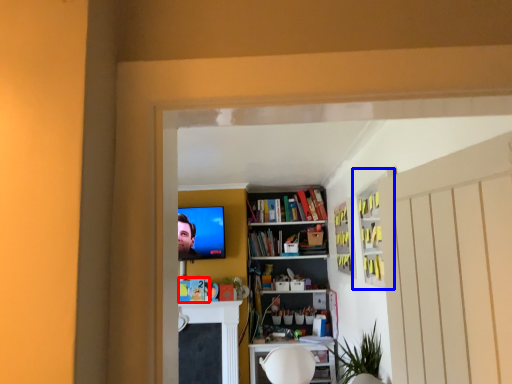
Question: Which object appears closest to the camera in this image, book (highlighted by a red box) or cabinet (highlighted by a blue box)?

Choices:
 (A) book
 (B) cabinet

Answer: (B)